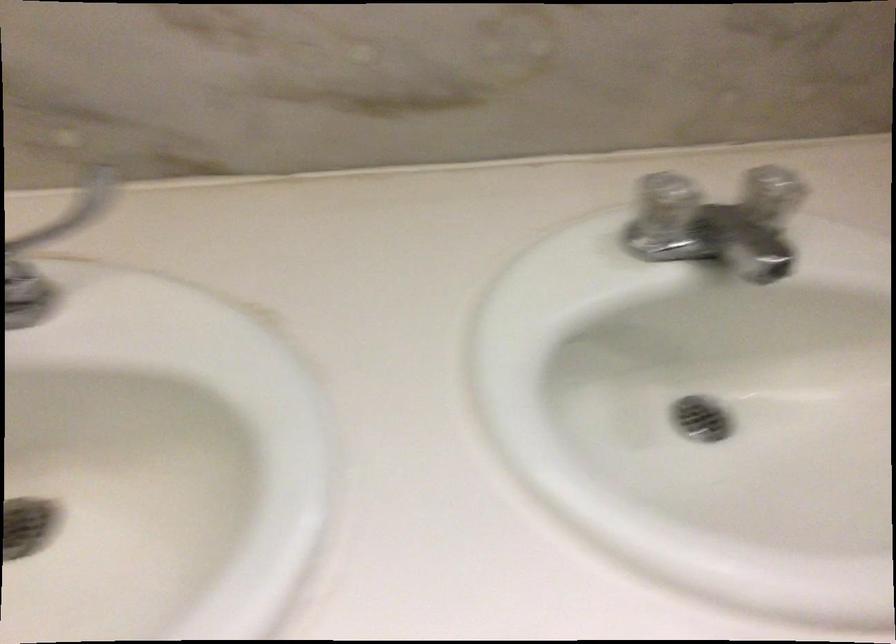
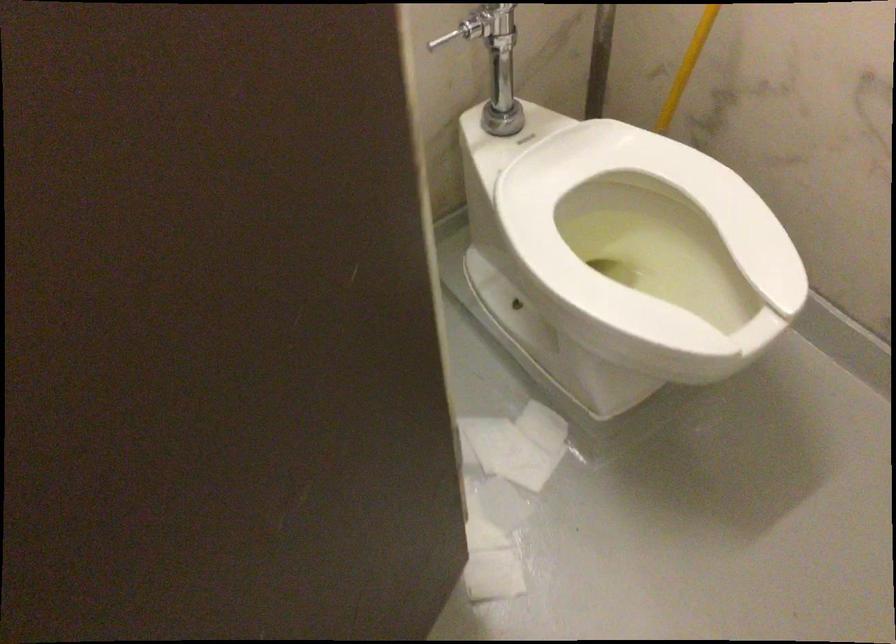
Question: In a continuous first-person perspective shot, in which direction is the camera moving?

Choices:
 (A) Left
 (B) Right
 (C) Forward
 (D) Backward

Answer: (B)